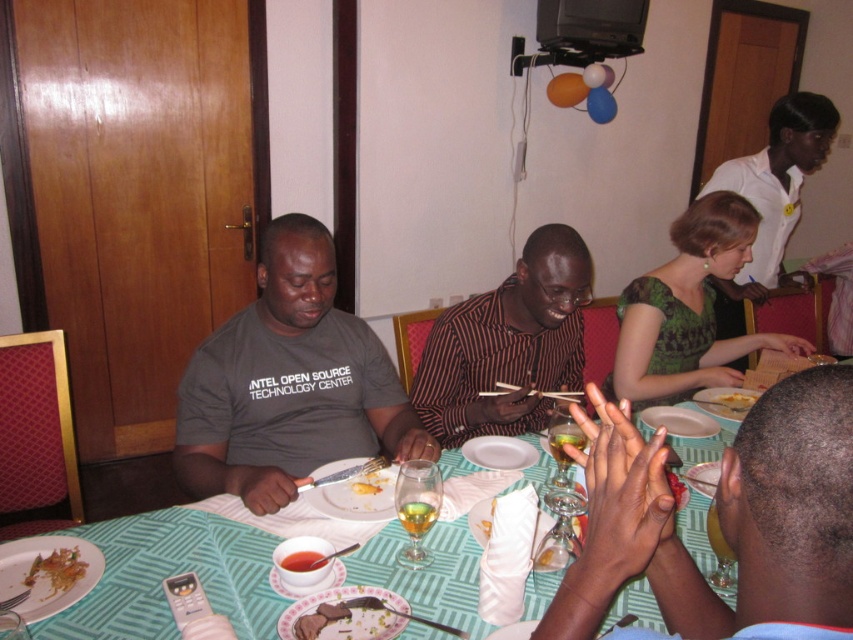
Can you confirm if green fabric table at center is positioned below yellow matte cake at center?

Yes.

Is green fabric table at center shorter than yellow matte cake at center?

In fact, green fabric table at center may be taller than yellow matte cake at center.

Who is more distant from viewer, (181, 515) or (732, 401)?

Positioned behind is point (732, 401).

Where is `green fabric table at center`? green fabric table at center is located at coordinates (171, 573).

The height and width of the screenshot is (640, 853). What do you see at coordinates (772, 196) in the screenshot? I see `green matte dress at upper right` at bounding box center [772, 196].

Which is behind, point (730, 307) or point (62, 588)?

The point (730, 307) is behind.

Find the location of a particular element. The image size is (853, 640). green matte dress at upper right is located at coordinates (772, 196).

In the scene shown: Measure the distance between chocolate glazed cake at lower center and yellow matte cake at center.

chocolate glazed cake at lower center and yellow matte cake at center are 3.94 feet apart from each other.

Is chocolate glazed cake at lower center positioned behind yellow matte cake at center?

No.

Is point (370, 634) farther from viewer compared to point (732, 394)?

No.

At what (x,y) coordinates should I click in order to perform the action: click on chocolate glazed cake at lower center. Please return your answer as a coordinate pair (x, y). Looking at the image, I should click on (334, 604).